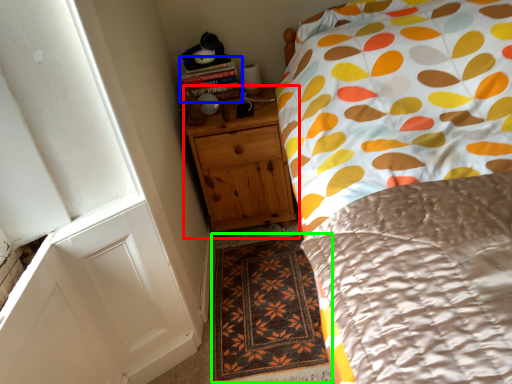
Question: Based on their relative distances, which object is nearer to chest of drawers (highlighted by a red box)? Choose from book (highlighted by a blue box) and doormat (highlighted by a green box).

Choices:
 (A) book
 (B) doormat

Answer: (A)